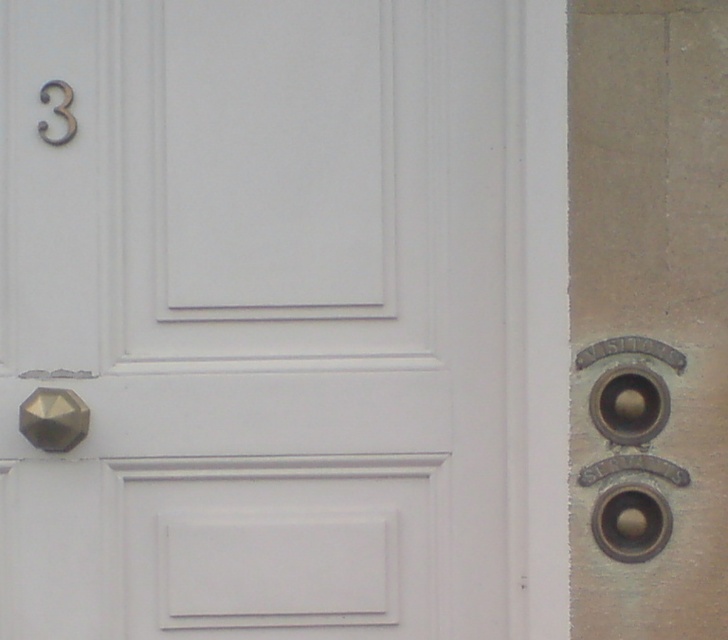
You are trying to open the white matte door at center and notice the matte gold door handle at upper left. Which object would you need to grasp to open the door?

You would need to grasp the matte gold door handle at upper left to open the white matte door at center since the door handle is part of the door mechanism.

You are a delivery person trying to deliver a package to apartment 3. You see the white matte door at center and the polished brass knob at lower left. Which object should you use to open the door?

You should use the polished brass knob at lower left to open the white matte door at center since knobs are typically used to open doors.